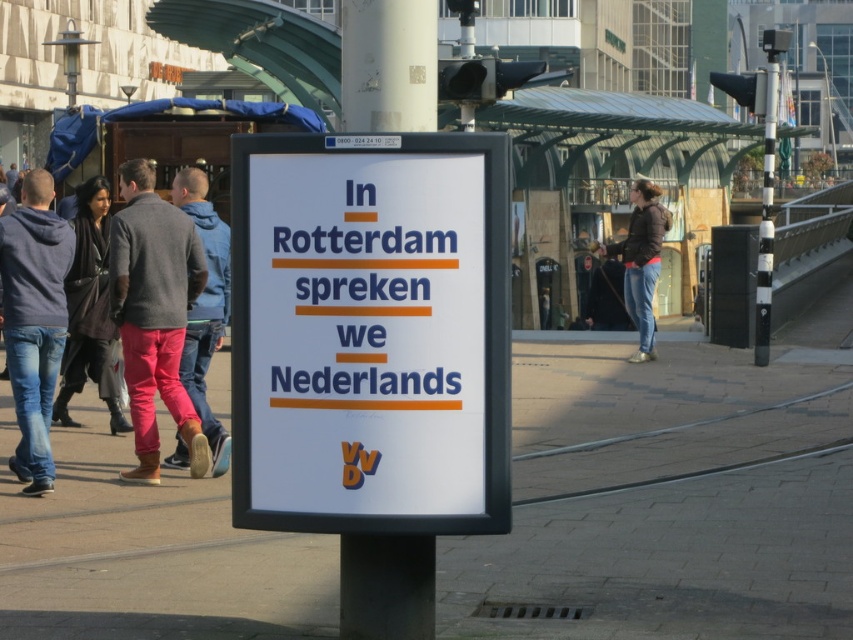
Is white concrete pavement at center bigger than dark blue jacket at center?

Indeed, white concrete pavement at center has a larger size compared to dark blue jacket at center.

Can you confirm if white concrete pavement at center is positioned above dark blue jacket at center?

No, white concrete pavement at center is not above dark blue jacket at center.

This screenshot has height=640, width=853. Identify the location of white concrete pavement at center. (669, 499).

Can you confirm if white concrete pavement at center is positioned above jeans at center?

Actually, white concrete pavement at center is below jeans at center.

Does white concrete pavement at center have a larger size compared to jeans at center?

Yes.

What are the coordinates of `white concrete pavement at center` in the screenshot? It's located at (669, 499).

This screenshot has height=640, width=853. Describe the element at coordinates (370, 333) in the screenshot. I see `white plastic sign at center` at that location.

Is white plastic sign at center positioned behind black and white striped pole at right?

No, white plastic sign at center is closer to the viewer.

Is point (323, 152) farther from viewer compared to point (764, 138)?

No, (323, 152) is closer to viewer.

Where is `white plastic sign at center`? This screenshot has height=640, width=853. white plastic sign at center is located at coordinates (370, 333).